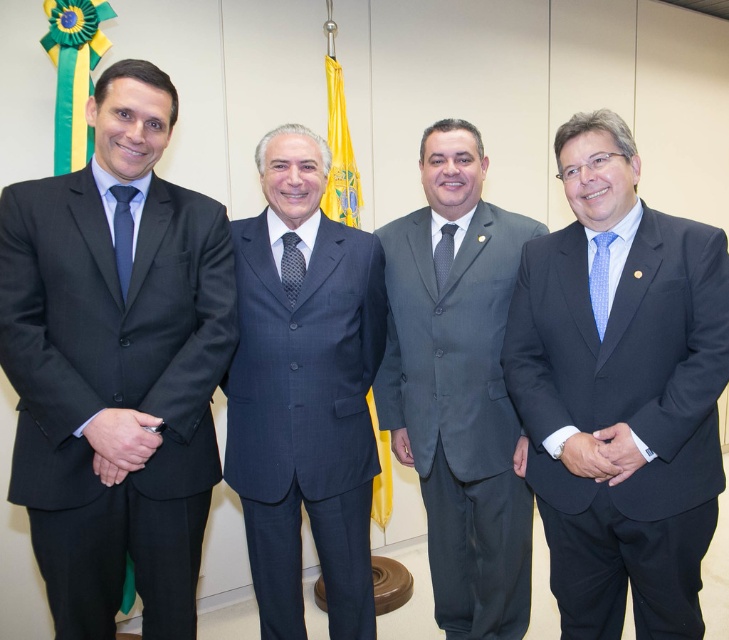
Question: Can you confirm if matte black suit at left is positioned to the right of dark blue suit at center?

Choices:
 (A) no
 (B) yes

Answer: (A)

Question: Which point is farther to the camera?

Choices:
 (A) pos(444,244)
 (B) pos(564,620)
 (C) pos(116,256)
 (D) pos(491,436)

Answer: (A)

Question: Does yellow fabric flag at upper center have a smaller size compared to black dotted tie at center?

Choices:
 (A) no
 (B) yes

Answer: (A)

Question: Which object is the farthest from the dark blue suit at center?

Choices:
 (A) gray suit at center
 (B) gray dotted tie at center
 (C) black dotted tie at center

Answer: (B)

Question: Among these points, which one is nearest to the camera?

Choices:
 (A) (122, 90)
 (B) (295, 296)
 (C) (117, 205)
 (D) (324, 61)

Answer: (A)

Question: Can you confirm if matte black suit at left is bigger than dark blue suit at right?

Choices:
 (A) yes
 (B) no

Answer: (B)